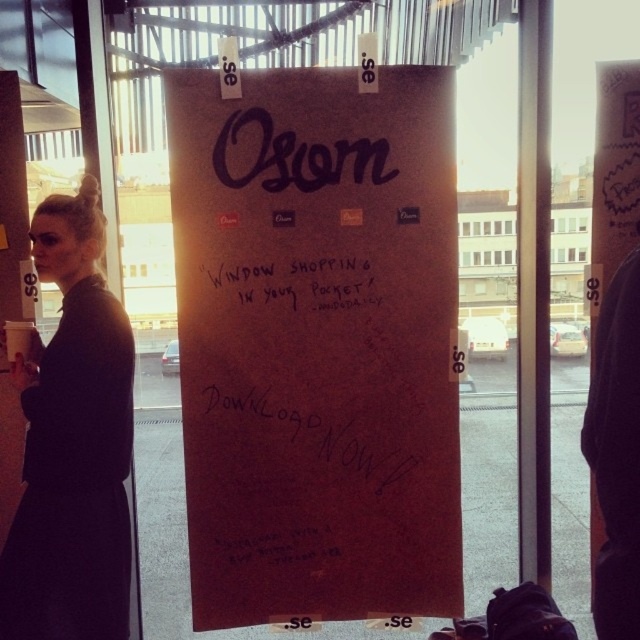
You are standing in front of the sign and want to place a small sticker between the dark gray coat at left and the black fabric at right. Based on their positions, where should you place the sticker?

The dark gray coat at left is to the left of black fabric at right, so you should place the sticker between them, to the right of the dark gray coat at left and to the left of the black fabric at right.

You are trying to decide which item to take with you from the scene. The dark gray coat at left and the black fabric at right are both available. Based on their sizes, which one would you choose if you need something larger?

The black fabric at right is larger than the dark gray coat at left, so you should choose the black fabric at right.